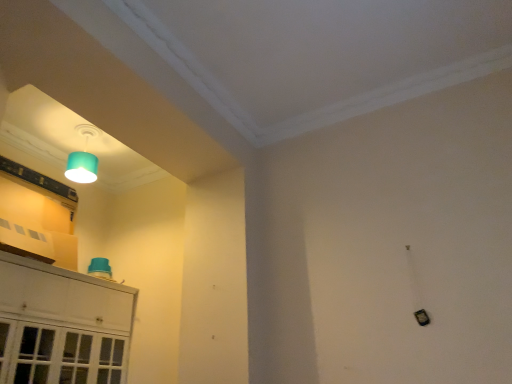
What do you see at coordinates (83, 159) in the screenshot? I see `teal matte lampshade at upper left` at bounding box center [83, 159].

What is the approximate width of teal matte lampshade at upper left?

It is 28.73 centimeters.

The image size is (512, 384). What are the coordinates of `teal matte lampshade at upper left` in the screenshot? It's located at (83, 159).

Identify the location of teal matte lampshade at upper left. This screenshot has width=512, height=384. (83, 159).